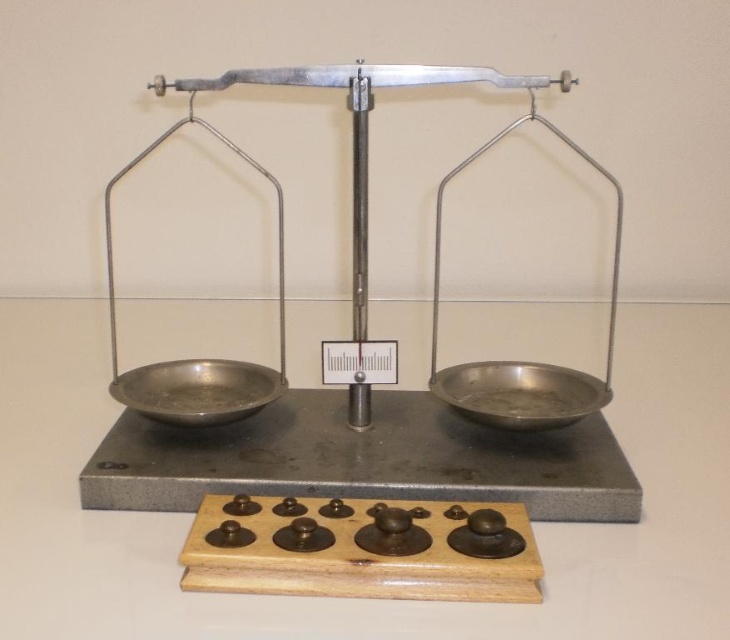
Question: Considering the real-world distances, which object is closest to the metallic silver bowl at right?

Choices:
 (A) metallic scale at center
 (B) wooden tray at center

Answer: (A)

Question: Is wooden tray at center in front of metallic silver bowl at right?

Choices:
 (A) yes
 (B) no

Answer: (A)

Question: Among these points, which one is nearest to the camera?

Choices:
 (A) pyautogui.click(x=358, y=458)
 (B) pyautogui.click(x=177, y=364)

Answer: (A)

Question: Is metallic silver bowl at right thinner than polished metal bowl at left?

Choices:
 (A) yes
 (B) no

Answer: (A)

Question: Which of the following is the farthest from the observer?

Choices:
 (A) 220,384
 (B) 548,396
 (C) 376,396

Answer: (C)

Question: From the image, what is the correct spatial relationship of metallic scale at center in relation to polished metal bowl at left?

Choices:
 (A) above
 (B) below

Answer: (A)